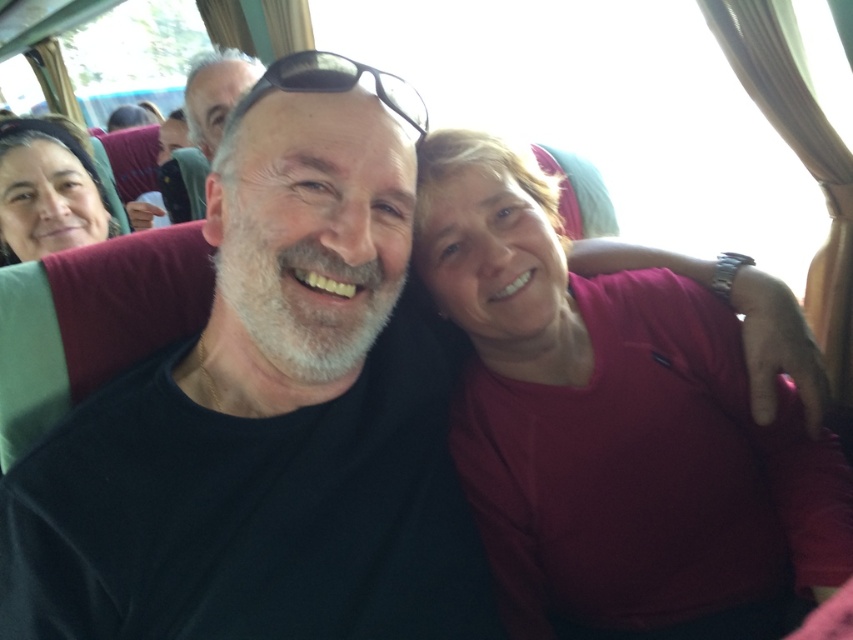
Question: Is matte red shirt at center wider than matte black hair at left?

Choices:
 (A) yes
 (B) no

Answer: (A)

Question: Does matte black hair at left appear under black matte sunglasses at center?

Choices:
 (A) yes
 (B) no

Answer: (B)

Question: Which of the following is the farthest from the observer?

Choices:
 (A) (19, 516)
 (B) (6, 218)
 (C) (247, 109)

Answer: (B)

Question: Does black matte shirt at center appear on the right side of matte black hair at left?

Choices:
 (A) no
 (B) yes

Answer: (B)

Question: Which point appears closest to the camera in this image?

Choices:
 (A) (41, 170)
 (B) (280, 509)
 (C) (619, 360)
 (D) (374, 83)

Answer: (D)

Question: Which of the following is the closest to the observer?

Choices:
 (A) (38, 141)
 (B) (393, 104)

Answer: (B)